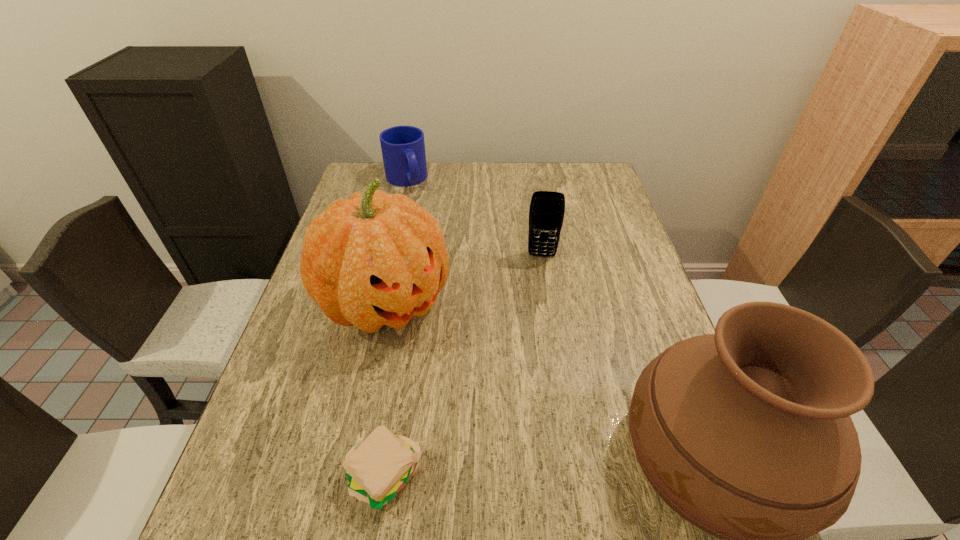
This screenshot has height=540, width=960. Identify the location of blank area located 0.050m on the carved face of the pumpkin. (438, 354).

You are a GUI agent. You are given a task and a screenshot of the screen. Output one action in this format:
    pyautogui.click(x=<x>, y=<y>)
    Task: Click on the vacant region located on the carved face of the pumpkin
    This screenshot has width=960, height=540.
    Given the screenshot: What is the action you would take?
    pyautogui.click(x=458, y=374)

Where is `vacant space located 0.200m on the carved face of the pumpkin`? The image size is (960, 540). vacant space located 0.200m on the carved face of the pumpkin is located at coordinates (482, 398).

Identify the location of vacant space situated 0.250m on the side with the handle of the mug. (433, 237).

Locate an element on the screen. This screenshot has width=960, height=540. vacant space located on the side with the handle of the mug is located at coordinates (443, 254).

Where is `vacant space located 0.080m on the side with the handle of the mug`? vacant space located 0.080m on the side with the handle of the mug is located at coordinates (418, 207).

Find the location of `object located at the far edge`. object located at the far edge is located at coordinates (403, 148).

Find the location of `object that is at the near edge`. object that is at the near edge is located at coordinates (380, 468).

Locate an element on the screen. This screenshot has width=960, height=540. pumpkin located in the left edge section of the desktop is located at coordinates (376, 259).

Find the location of `mug located in the left edge section of the desktop`. mug located in the left edge section of the desktop is located at coordinates (403, 148).